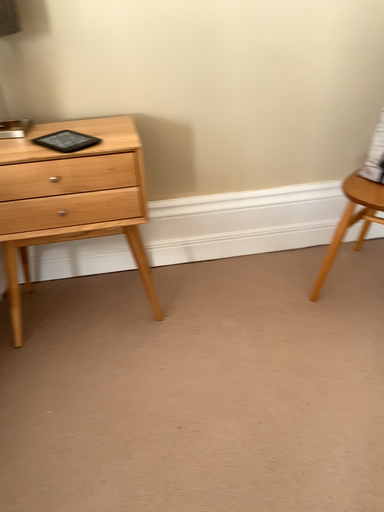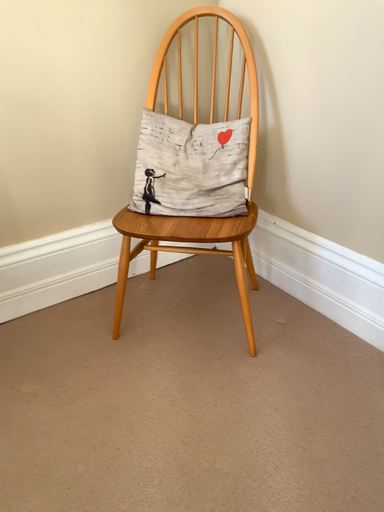
Question: Which way did the camera rotate in the video?

Choices:
 (A) rotated downward
 (B) rotated upward

Answer: (B)